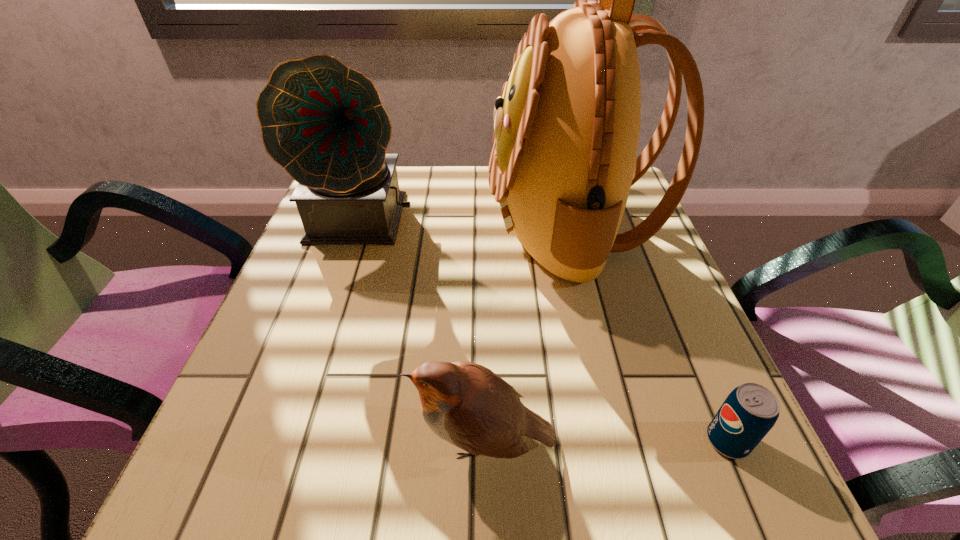
Locate an element on the screen. This screenshot has width=960, height=540. the tallest object is located at coordinates (566, 130).

This screenshot has height=540, width=960. In order to click on record player in this screenshot , I will do `click(323, 122)`.

The width and height of the screenshot is (960, 540). I want to click on the third shortest object, so click(x=323, y=122).

Where is `the third tallest object`? the third tallest object is located at coordinates (466, 404).

At what (x,y) coordinates should I click in order to perform the action: click on pop. Please return your answer as a coordinate pair (x, y). The image size is (960, 540). Looking at the image, I should click on (749, 412).

You are a GUI agent. You are given a task and a screenshot of the screen. Output one action in this format:
    pyautogui.click(x=<x>, y=<y>)
    Task: Click on the vacant space located on the front-facing side of the tallest object
    
    Given the screenshot: What is the action you would take?
    pyautogui.click(x=456, y=226)

Identify the location of vacant space located 0.270m on the front-facing side of the tallest object. This screenshot has width=960, height=540. (367, 226).

You are a GUI agent. You are given a task and a screenshot of the screen. Output one action in this format:
    pyautogui.click(x=<x>, y=<y>)
    Task: Click on the vacant area situated 0.250m on the front-facing side of the tallest object
    
    Given the screenshot: What is the action you would take?
    pyautogui.click(x=376, y=226)

The image size is (960, 540). I want to click on vacant space located on the horn of the leftmost object, so click(x=312, y=376).

The height and width of the screenshot is (540, 960). I want to click on blank space located 0.070m at the face of the bird, so click(363, 441).